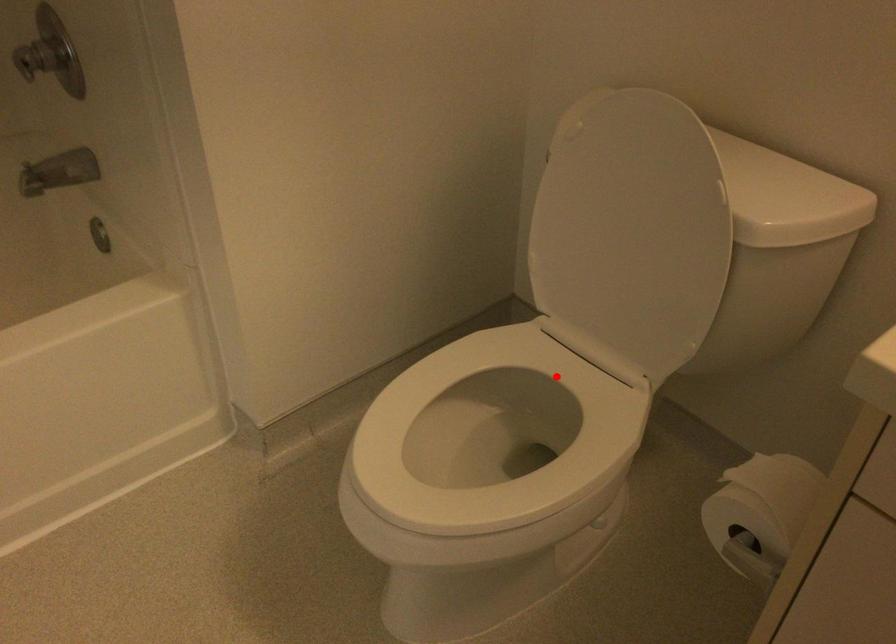
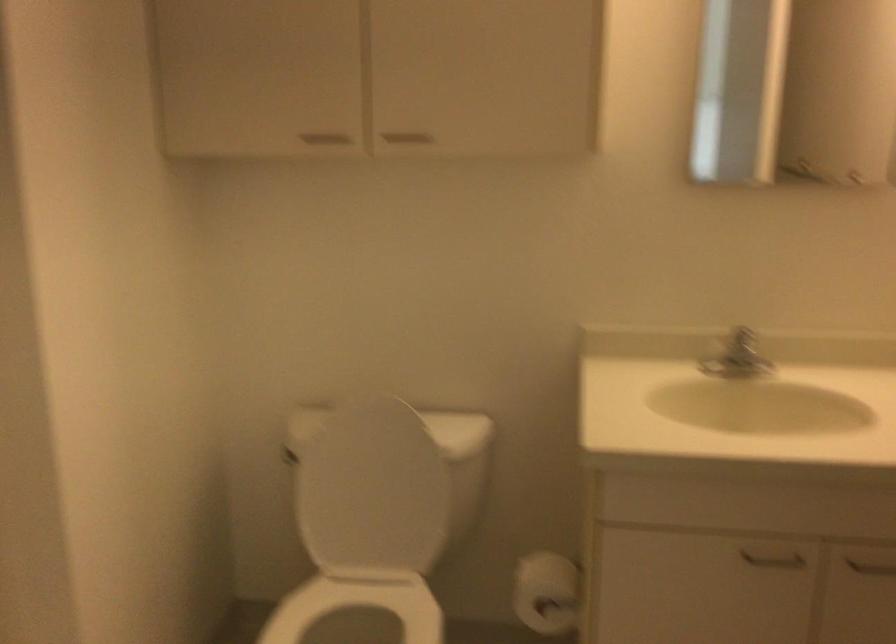
Question: A red point is marked in image1. In image2, is the corresponding 3D point closer to the camera or farther? Reply with the corresponding letter.

Choices:
 (A) The corresponding 3D point is closer.
 (B) The corresponding 3D point is farther.

Answer: (B)